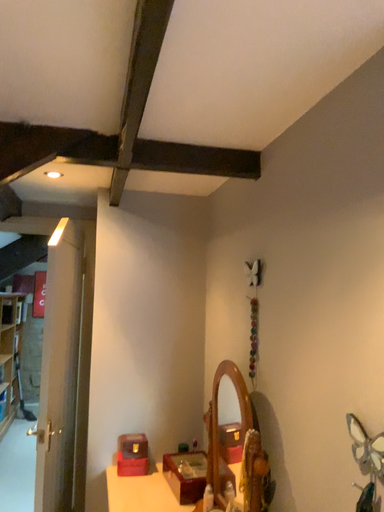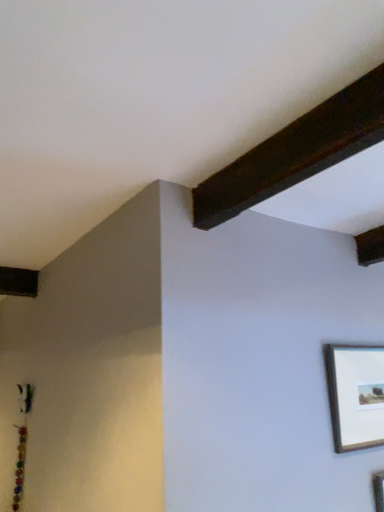
Question: Which way did the camera rotate in the video?

Choices:
 (A) rotated downward
 (B) rotated upward

Answer: (B)